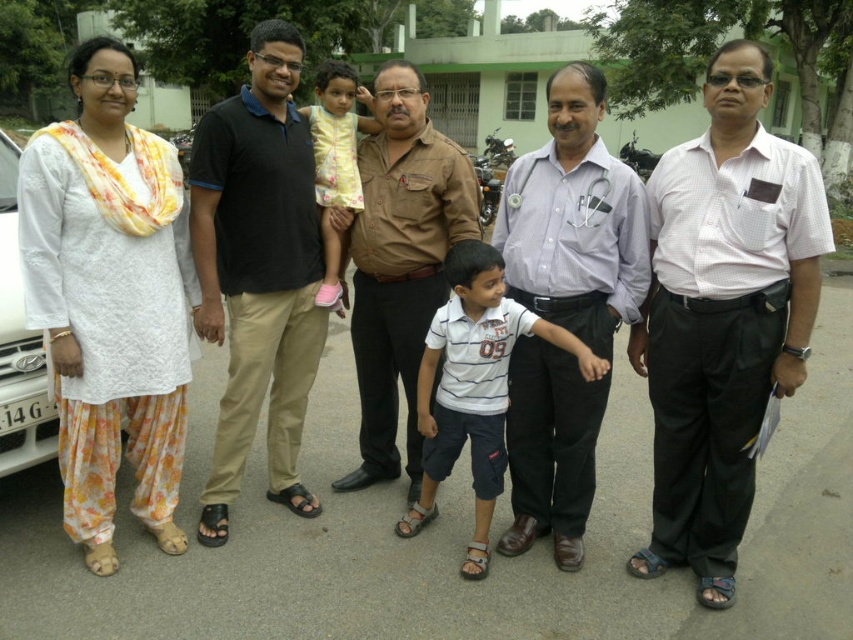
Question: Does white checkered shirt at center lie in front of brown cotton shirt at center?

Choices:
 (A) yes
 (B) no

Answer: (A)

Question: Can you confirm if white shirt at center is positioned to the right of white cotton shirt at center?

Choices:
 (A) no
 (B) yes

Answer: (B)

Question: Which of the following is the closest to the observer?

Choices:
 (A) (45, 432)
 (B) (488, 369)

Answer: (B)

Question: Which object is closer to the camera taking this photo?

Choices:
 (A) black cotton shirt at center
 (B) white cotton shirt at center
 (C) white checkered shirt at center

Answer: (C)

Question: Does black cotton shirt at center appear under white cotton shirt at center?

Choices:
 (A) no
 (B) yes

Answer: (A)

Question: Estimate the real-world distances between objects in this image. Which object is farther from the black cotton shirt at center?

Choices:
 (A) white checkered shirt at center
 (B) brown cotton shirt at center
 (C) yellow floral dress at center

Answer: (A)